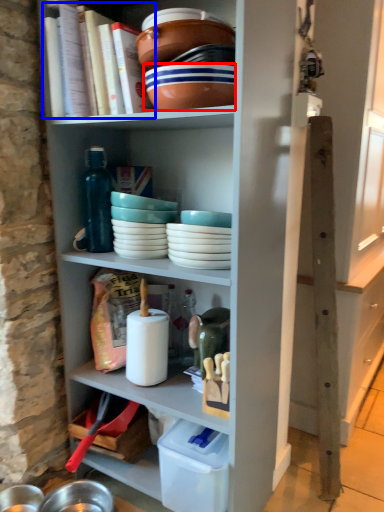
Question: Which point is closer to the camera, bowl (highlighted by a red box) or book (highlighted by a blue box)?

Choices:
 (A) bowl
 (B) book

Answer: (A)